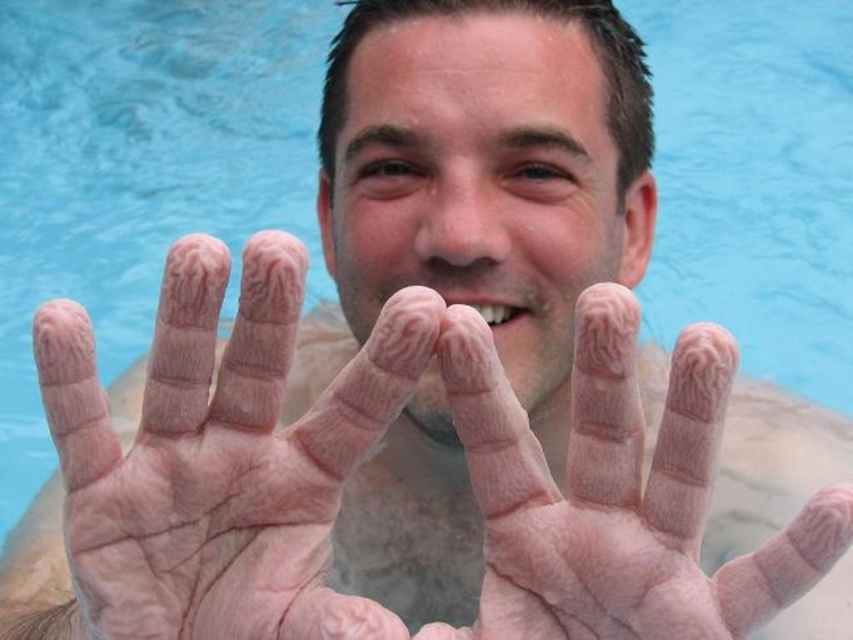
Can you confirm if pale skin palm at center is positioned below pink flesh at center?

No, pale skin palm at center is not below pink flesh at center.

Is pale skin palm at center positioned at the back of pink flesh at center?

Yes.

Find the location of a particular element. The height and width of the screenshot is (640, 853). pale skin palm at center is located at coordinates (221, 456).